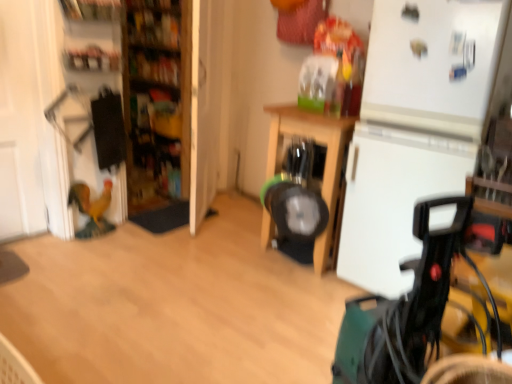
In order to click on vacant area that lies in front of wooden table at center in this screenshot , I will do `click(295, 301)`.